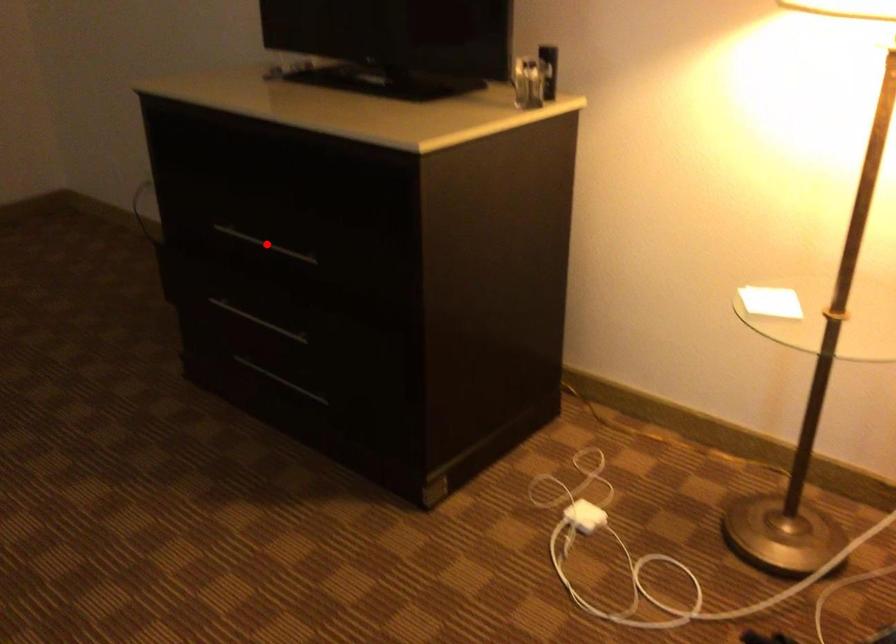
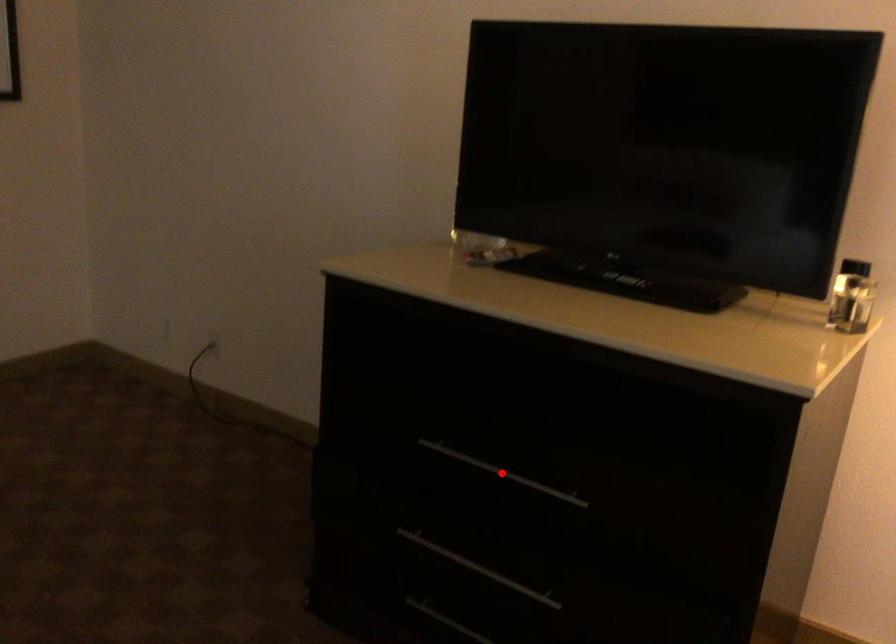
I am providing you with two images of the same scene from different viewpoints. A red point is marked on the first image and another point is marked on the second image. Does the point marked in image1 correspond to the same location as the one in image2?

Yes